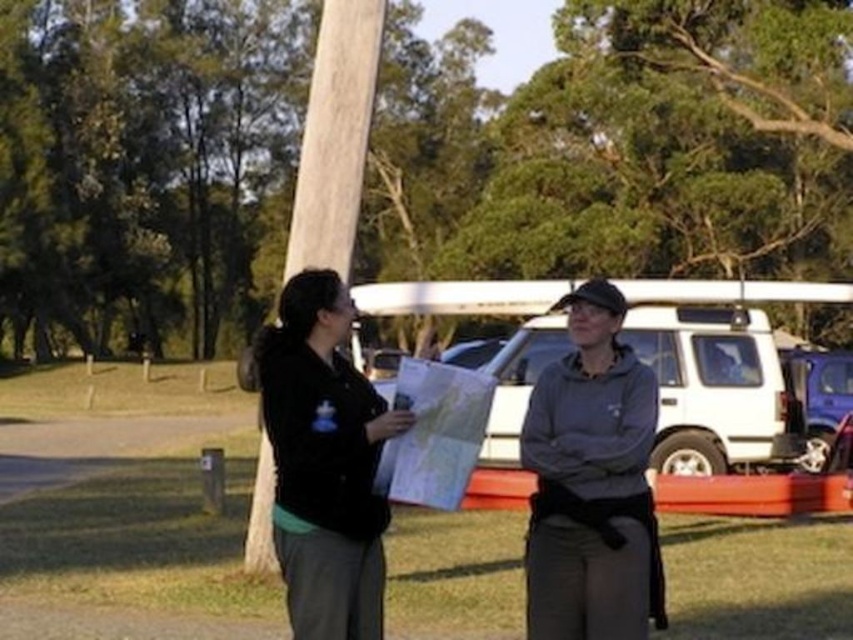
The width and height of the screenshot is (853, 640). I want to click on black matte jacket at center, so click(x=323, y=461).

Identify the location of black matte jacket at center. tap(323, 461).

Does brushed metal pole at center come in front of white matte suv at center?

Yes, brushed metal pole at center is in front of white matte suv at center.

Is brushed metal pole at center thinner than white matte suv at center?

No.

Is point (587, 212) more distant than point (445, 362)?

Yes.

This screenshot has width=853, height=640. Identify the location of brushed metal pole at center. (595, 157).

Can you confirm if gray fleece jacket at center is smaller than metallic blue car at right?

Yes, gray fleece jacket at center is smaller than metallic blue car at right.

Is point (579, 339) positioned behind point (833, 420)?

No, (579, 339) is in front of (833, 420).

Find the location of `gray fleece jacket at center`. gray fleece jacket at center is located at coordinates (590, 483).

This screenshot has width=853, height=640. What are the coordinates of `gray fleece jacket at center` in the screenshot? It's located at (590, 483).